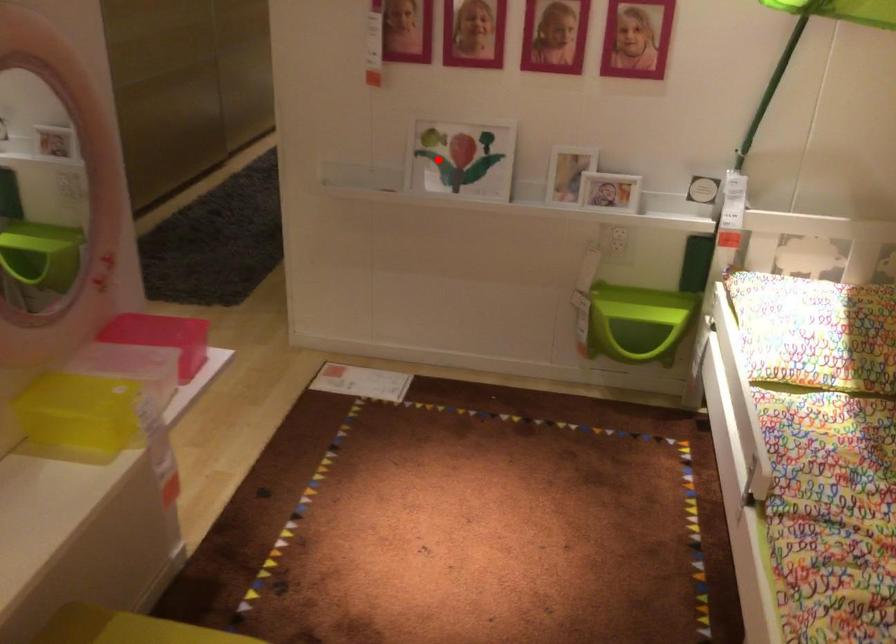
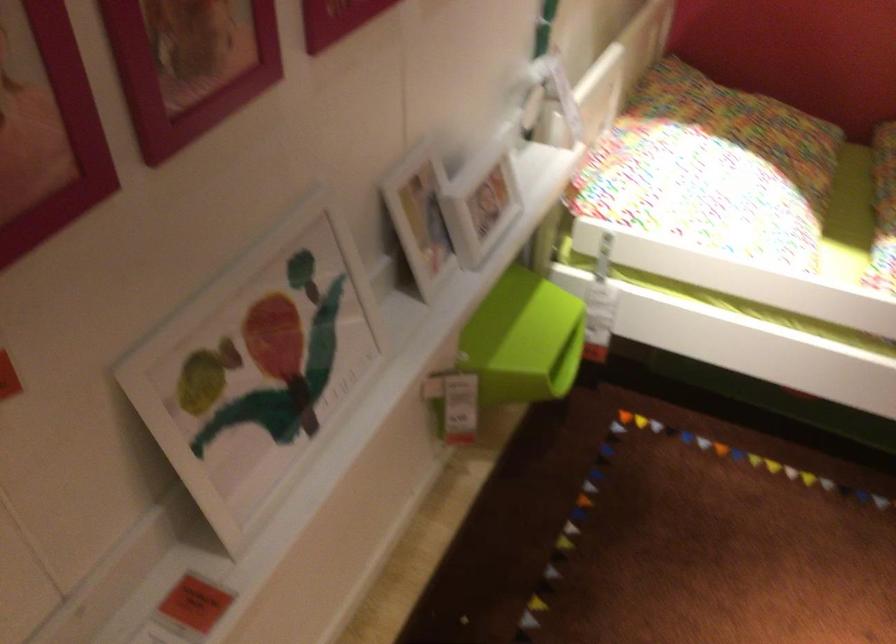
Where in the second image is the point corresponding to the highlighted location from the first image?

(257, 368)